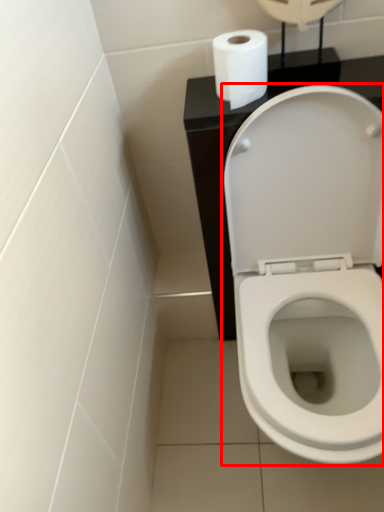
Question: Observing the image, what is the correct spatial positioning of toilet (annotated by the red box) in reference to toilet paper?

Choices:
 (A) left
 (B) right

Answer: (B)